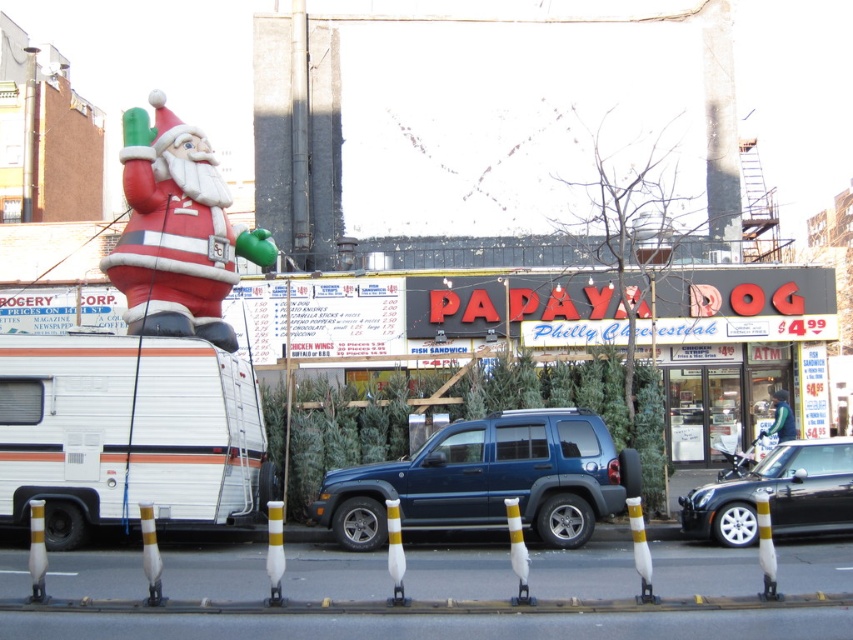
In the scene shown: You are a delivery person trying to load a large package onto the white matte camper van at left. The package requires clearance that is only possible if the van is taller than the matte plastic santa at upper left. Based on the scene, can the package be loaded onto the van?

The white matte camper van at left is smaller than the matte plastic santa at upper left, so the package cannot be loaded onto the van because the van is not taller than the santa.

Based on the photo, you are a delivery person trying to load a large package onto the white matte camper van at left. The matte plastic santa at upper left is in the way. Can you move the santa to the side to access the van?

The white matte camper van at left is positioned under the matte plastic santa at upper left, so moving the santa to the side would allow access to the van.